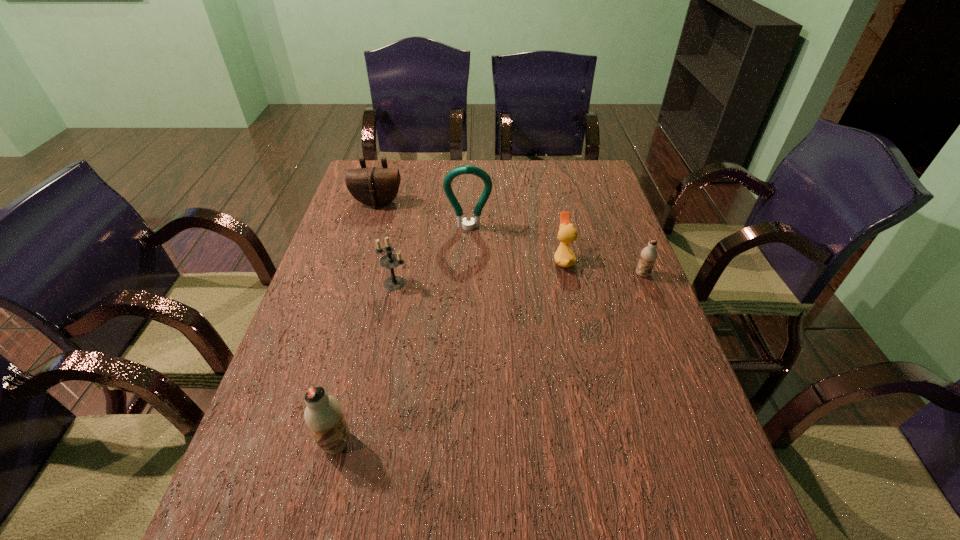
Where is `the left chocolate milk`? The height and width of the screenshot is (540, 960). the left chocolate milk is located at coordinates coord(323,414).

At what (x,y) coordinates should I click in order to perform the action: click on the nearer chocolate milk. Please return your answer as a coordinate pair (x, y). This screenshot has width=960, height=540. Looking at the image, I should click on (323, 414).

You are a GUI agent. You are given a task and a screenshot of the screen. Output one action in this format:
    pyautogui.click(x=<x>, y=<y>)
    Task: Click on the right chocolate milk
    Image resolution: width=960 pixels, height=540 pixels.
    Given the screenshot: What is the action you would take?
    pyautogui.click(x=649, y=254)

This screenshot has height=540, width=960. Identify the location of the farther chocolate milk. pyautogui.click(x=649, y=254).

The width and height of the screenshot is (960, 540). I want to click on the fourth object from left to right, so click(466, 169).

Find the location of a particular element. This screenshot has width=960, height=540. bottle opener is located at coordinates (466, 169).

Locate an element on the screen. The width and height of the screenshot is (960, 540). candle holder is located at coordinates (390, 261).

The image size is (960, 540). Find the location of `the farthest object`. the farthest object is located at coordinates (375, 187).

Image resolution: width=960 pixels, height=540 pixels. What are the coordinates of `the second object from right to left` in the screenshot? It's located at (564, 256).

I want to click on vacant space situated on the right of the left chocolate milk, so click(x=536, y=442).